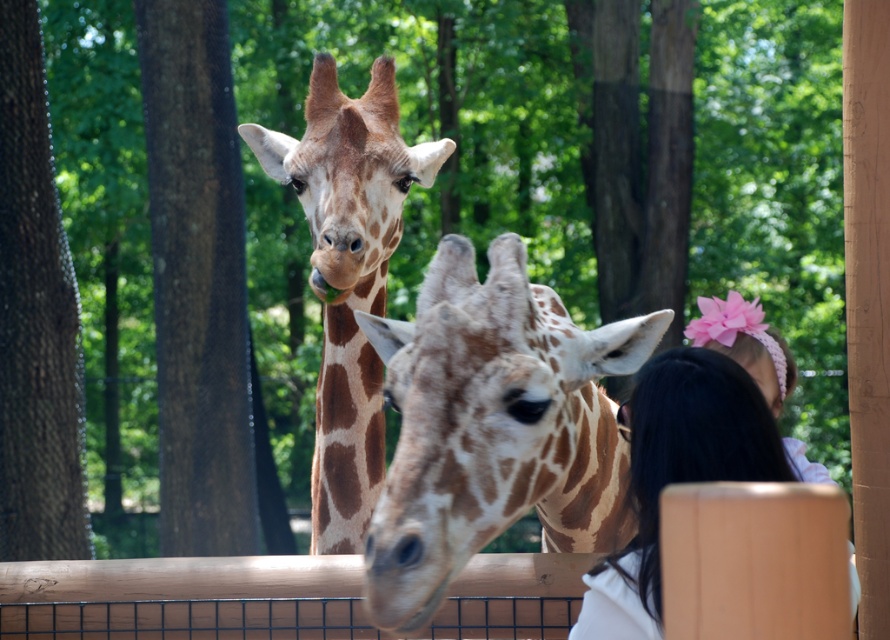
Question: Which point is farther from the camera taking this photo?

Choices:
 (A) (371, 176)
 (B) (646, 410)

Answer: (A)

Question: Is spotted fur giraffe at center positioned before smooth white shirt at lower right?

Choices:
 (A) yes
 (B) no

Answer: (B)

Question: Can you confirm if brown spotted giraffe at center is positioned below smooth white shirt at lower right?

Choices:
 (A) no
 (B) yes

Answer: (A)

Question: Considering the real-world distances, which object is farthest from the spotted fur giraffe at center?

Choices:
 (A) brown spotted giraffe at center
 (B) smooth white shirt at lower right

Answer: (A)

Question: Which of the following is the farthest from the observer?

Choices:
 (A) brown spotted giraffe at center
 (B) smooth white shirt at lower right
 (C) spotted fur giraffe at center

Answer: (A)

Question: Is spotted fur giraffe at center below smooth white shirt at lower right?

Choices:
 (A) no
 (B) yes

Answer: (A)